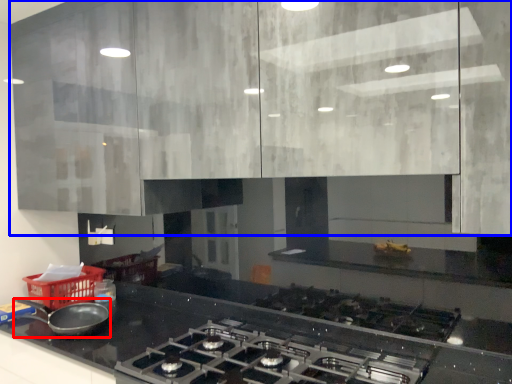
Question: Which object is closer to the camera taking this photo, kitchen appliance (highlighted by a red box) or cabinetry (highlighted by a blue box)?

Choices:
 (A) kitchen appliance
 (B) cabinetry

Answer: (B)